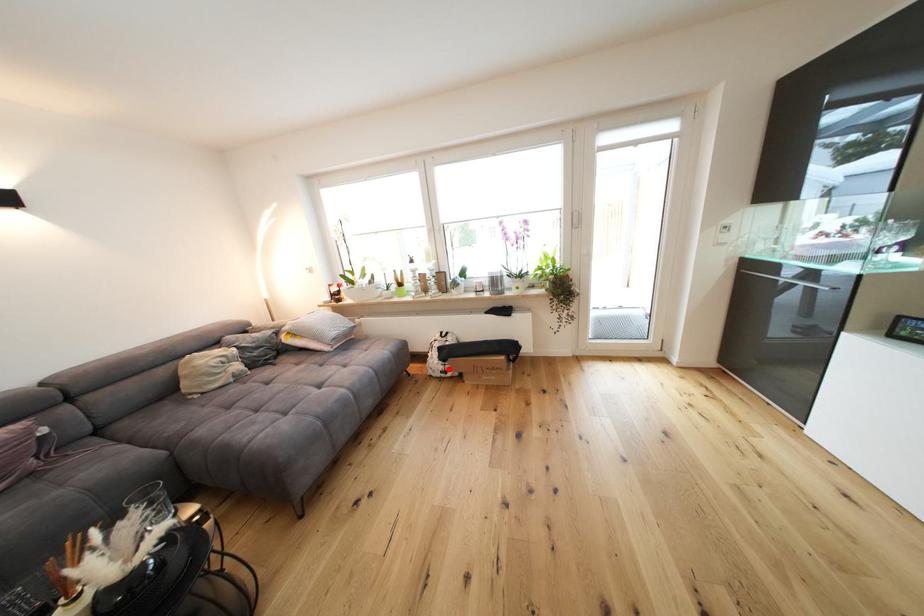
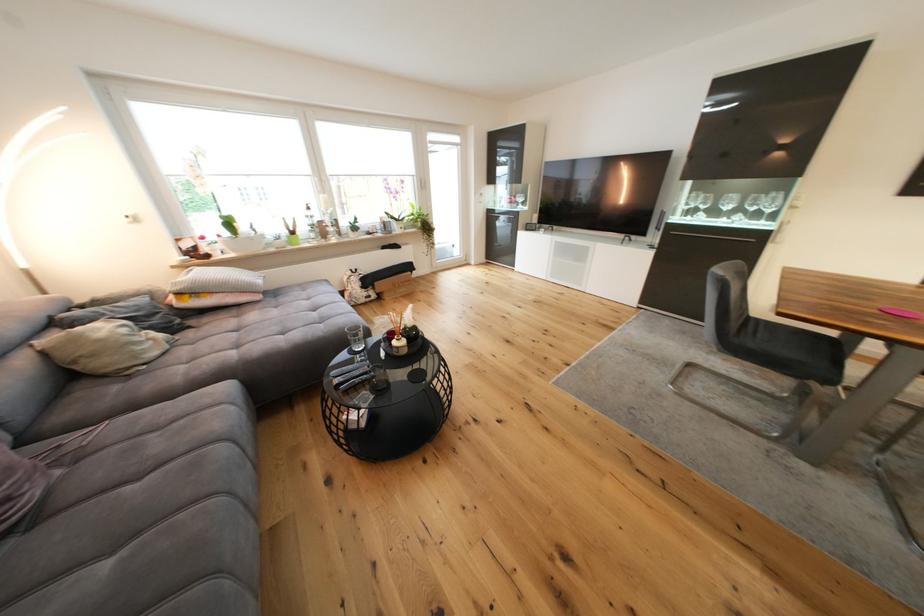
Question: A red point is marked in image1. In image2, is the corresponding 3D point closer to the camera or farther? Reply with the corresponding letter.

Choices:
 (A) The corresponding 3D point is closer.
 (B) The corresponding 3D point is farther.

Answer: (A)